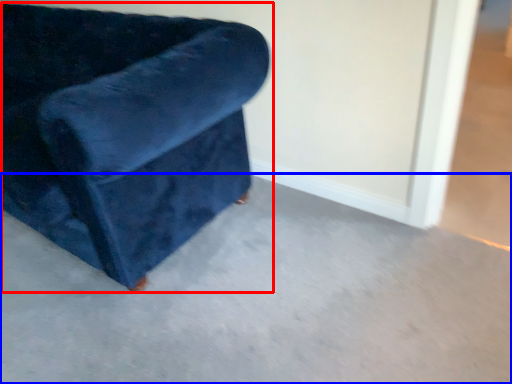
Question: Which of the following is the farthest to the observer, chair (highlighted by a red box) or concrete (highlighted by a blue box)?

Choices:
 (A) chair
 (B) concrete

Answer: (A)